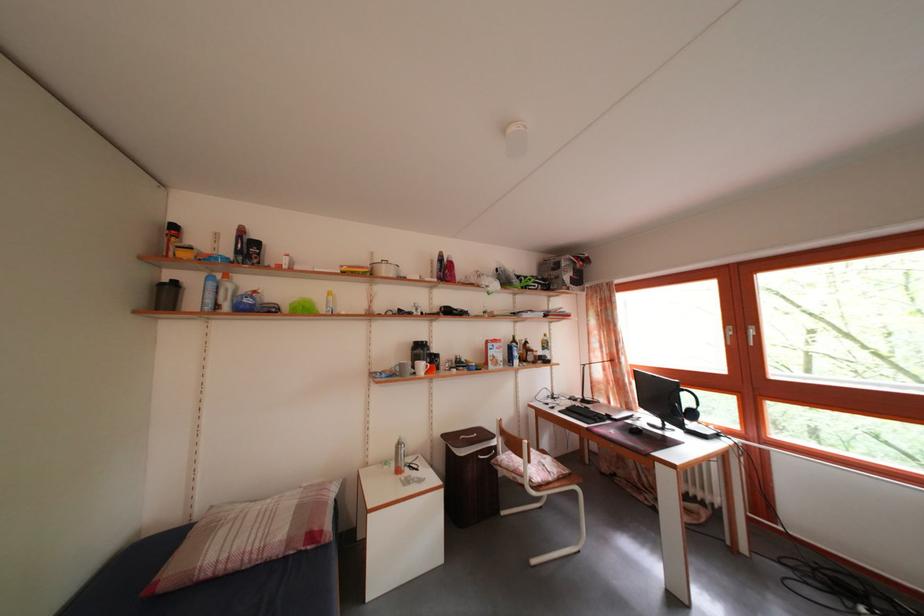
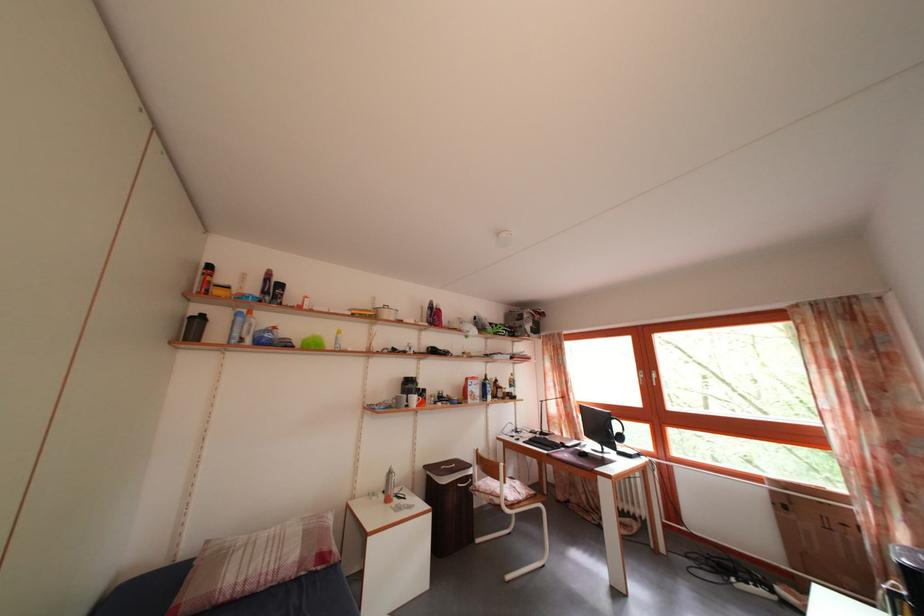
Based on the photo, the images are taken continuously from a first-person perspective. In which direction are you moving?

The movement direction of the cameraman is left, backward.